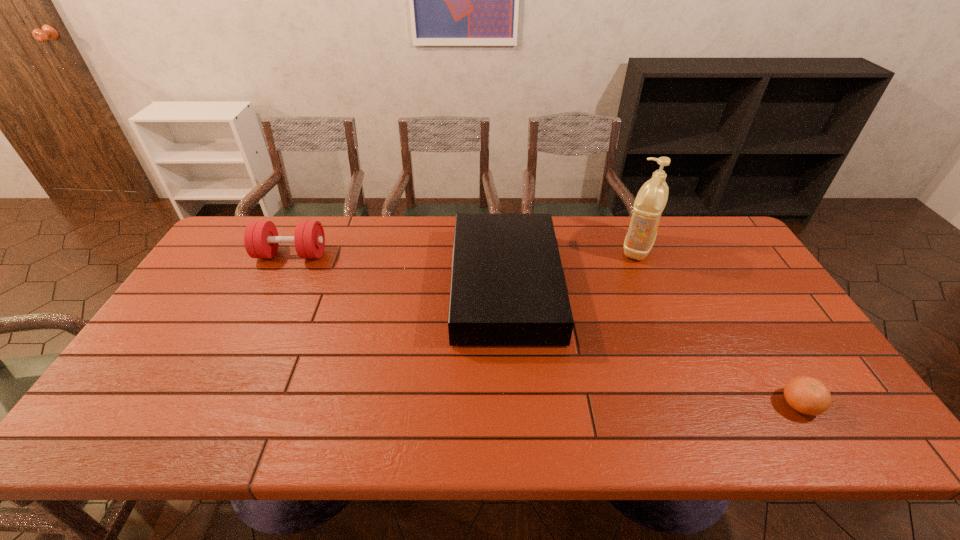
Locate an element on the screen. This screenshot has width=960, height=540. free space that satisfies the following two spatial constraints: 1. at the front of the CD player for disc insertion; 2. on the right side of the nearest object is located at coordinates (513, 404).

Locate an element on the screen. Image resolution: width=960 pixels, height=540 pixels. vacant space that satisfies the following two spatial constraints: 1. at the front of the second shortest object for disc insertion; 2. on the right side of the nearest object is located at coordinates (513, 404).